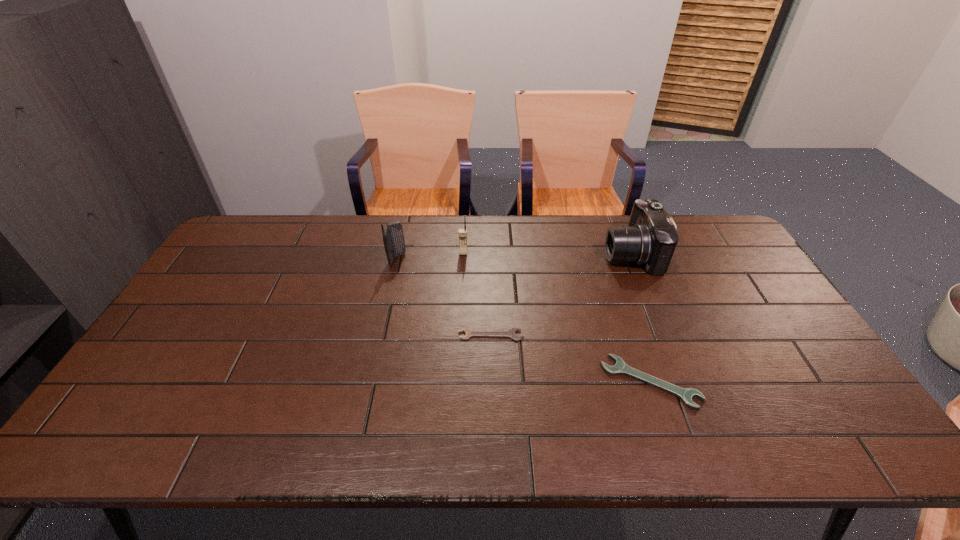
The width and height of the screenshot is (960, 540). In order to click on free point located 0.360m on the lens of the camera in this screenshot , I will do `click(497, 253)`.

The height and width of the screenshot is (540, 960). What are the coordinates of `free space located 0.190m on the front of the right cellular telephone, where the keypad is located` in the screenshot? It's located at (462, 295).

This screenshot has width=960, height=540. Find the location of `free space located 0.330m on the back of the right wrench`. free space located 0.330m on the back of the right wrench is located at coordinates (613, 274).

The height and width of the screenshot is (540, 960). Find the location of `vacant space located on the right of the shortest object`. vacant space located on the right of the shortest object is located at coordinates (574, 335).

Find the location of a particular element. The width and height of the screenshot is (960, 540). camera that is at the far edge is located at coordinates (650, 239).

In order to click on free space at the far edge in this screenshot , I will do `click(342, 242)`.

Identify the location of vacant space at the near edge of the desktop. [x=507, y=452].

The height and width of the screenshot is (540, 960). In the image, there is a desktop. Identify the location of free space at the left edge. (197, 342).

I want to click on vacant region at the near left corner of the desktop, so [120, 448].

Locate an element on the screen. This screenshot has width=960, height=540. free point between the right wrench and the leftmost object is located at coordinates (524, 320).